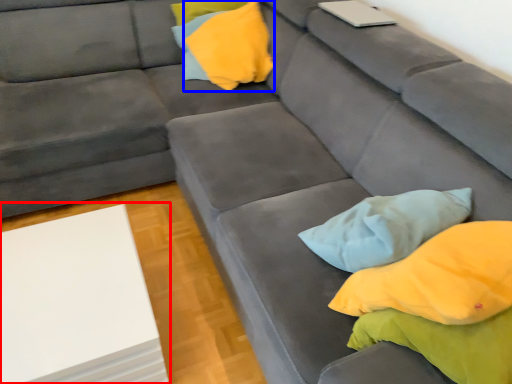
Question: Which point is further to the camera, table (highlighted by a red box) or pillow (highlighted by a blue box)?

Choices:
 (A) table
 (B) pillow

Answer: (B)